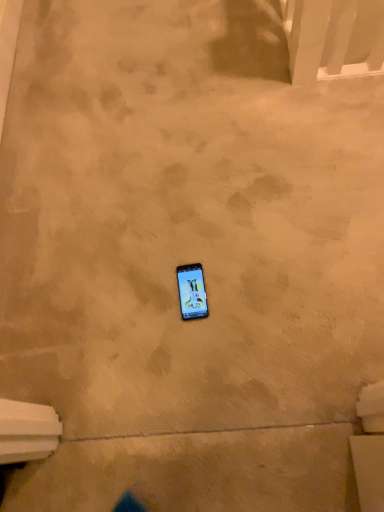
Where is `vacant space to the right of matte black phone at center`? The width and height of the screenshot is (384, 512). vacant space to the right of matte black phone at center is located at coordinates (245, 282).